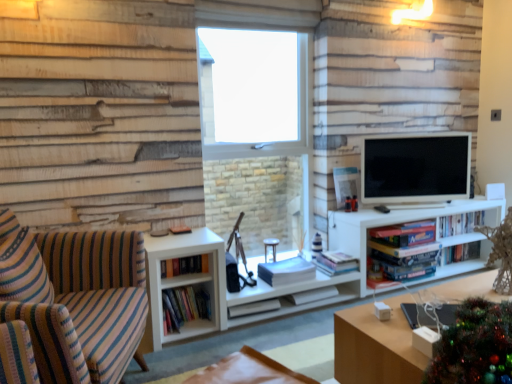
This screenshot has width=512, height=384. What are the coordinates of `wooden table at lower right` in the screenshot? It's located at (376, 346).

What are the coordinates of `hardcover books at center left, which is the 8th book in right-to-left order` in the screenshot? It's located at (184, 307).

In order to face striped fabric couch at left, should I rotate leftwards or rightwards?

You should rotate left by 27.601 degrees.

Locate an element on the screen. The width and height of the screenshot is (512, 384). white matte entertainment center at center is located at coordinates (352, 254).

How different are the orientations of hardcover books at center, placed as the 7th book when sorted from left to right, and white matte book at center, which is counted as the sixth book, starting from the right, in degrees?

1.54 degrees separate the facing orientations of hardcover books at center, placed as the 7th book when sorted from left to right, and white matte book at center, which is counted as the sixth book, starting from the right.

From the picture: How distant is hardcover books at center, placed as the 7th book when sorted from left to right, from white matte book at center, the 4th book viewed from the left?

A distance of 25.25 inches exists between hardcover books at center, placed as the 7th book when sorted from left to right, and white matte book at center, the 4th book viewed from the left.

Relative to white matte book at center, the 4th book viewed from the left, is hardcover books at center, which appears as the 3th book when viewed from the right, in front or behind?

In the image, hardcover books at center, which appears as the 3th book when viewed from the right, appears behind white matte book at center, the 4th book viewed from the left.

Considering the relative sizes of hardcover books at center, placed as the 7th book when sorted from left to right, and white matte book at center, which is counted as the sixth book, starting from the right, in the image provided, is hardcover books at center, placed as the 7th book when sorted from left to right, thinner than white matte book at center, which is counted as the sixth book, starting from the right,?

No, hardcover books at center, placed as the 7th book when sorted from left to right, is not thinner than white matte book at center, which is counted as the sixth book, starting from the right.

Would you consider white matte entertainment center at center to be distant from white matte book at center, the seventh book in the right-to-left sequence?

Actually, white matte entertainment center at center and white matte book at center, the seventh book in the right-to-left sequence, are a little close together.

Based on the photo, is white matte entertainment center at center surrounding white matte book at center, which is counted as the 3th book, starting from the left?

That's correct, white matte book at center, which is counted as the 3th book, starting from the left, is inside white matte entertainment center at center.

Which is nearer, (320, 304) or (256, 304)?

Point (320, 304) is positioned farther from the camera compared to point (256, 304).

Considering the sizes of objects white matte entertainment center at center and white matte book at center, the seventh book in the right-to-left sequence, in the image provided, who is smaller, white matte entertainment center at center or white matte book at center, the seventh book in the right-to-left sequence,?

white matte book at center, the seventh book in the right-to-left sequence.

Where is `entertainment center on the right side of white matte book at center, which is counted as the 3th book, starting from the left`? entertainment center on the right side of white matte book at center, which is counted as the 3th book, starting from the left is located at coordinates (352, 254).

From a real-world perspective, is white matte book at center, which is counted as the 3th book, starting from the left, over white matte entertainment center at center?

Actually, white matte book at center, which is counted as the 3th book, starting from the left, is physically below white matte entertainment center at center in the real world.

Between white matte book at center, which is counted as the 3th book, starting from the left, and white matte entertainment center at center, which one has smaller width?

Thinner between the two is white matte book at center, which is counted as the 3th book, starting from the left.

From the picture: In the image, is white matte book at center, which is counted as the 3th book, starting from the left, positioned in front of or behind white matte entertainment center at center?

Visually, white matte book at center, which is counted as the 3th book, starting from the left, is located behind white matte entertainment center at center.

Consider the image. How many degrees apart are the facing directions of hardcover book at center, which is the 5th book from right to left, and hardcover books at center left, the second book positioned from the left?

There is a 0.000756-degree angle between the facing directions of hardcover book at center, which is the 5th book from right to left, and hardcover books at center left, the second book positioned from the left.

From the image's perspective, which book is the 1st one below the hardcover books at center left, which is the 8th book in right-to-left order? Please provide its 2D coordinates.

[(313, 295)]

From a real-world perspective, is hardcover book at center, which is the 5th book from right to left, positioned over hardcover books at center left, which is the 8th book in right-to-left order, based on gravity?

No, from a real-world perspective, hardcover book at center, which is the 5th book from right to left, is not above hardcover books at center left, which is the 8th book in right-to-left order.

From a real-world perspective, is striped fabric couch at left above or below white matte entertainment center at center?

striped fabric couch at left is situated higher than white matte entertainment center at center in the real world.

Are striped fabric couch at left and white matte entertainment center at center far apart?

Actually, striped fabric couch at left and white matte entertainment center at center are a little close together.

Does striped fabric couch at left have a greater height compared to white matte entertainment center at center?

Correct, striped fabric couch at left is much taller as white matte entertainment center at center.

Locate an element on the screen. The image size is (512, 384). studio couch that is below the white matte entertainment center at center (from the image's perspective) is located at coordinates (75, 299).

Is white matte book at center, the seventh book in the right-to-left sequence, spatially inside matte black tv at right, or outside of it?

white matte book at center, the seventh book in the right-to-left sequence, lies outside matte black tv at right.

Is white matte book at center, which is counted as the 3th book, starting from the left, in front of or behind matte black tv at right in the image?

white matte book at center, which is counted as the 3th book, starting from the left, is in front of matte black tv at right.

Measure the distance from white matte book at center, the seventh book in the right-to-left sequence, to matte black tv at right.

The distance of white matte book at center, the seventh book in the right-to-left sequence, from matte black tv at right is 1.27 meters.

Is point (236, 310) positioned after point (447, 180)?

No.

From their relative heights in the image, would you say white matte entertainment center at center is taller or shorter than matte black tv at right?

Clearly, white matte entertainment center at center is taller compared to matte black tv at right.

Can you see white matte entertainment center at center touching matte black tv at right?

No, white matte entertainment center at center is not in contact with matte black tv at right.

How far apart are white matte entertainment center at center and matte black tv at right?

white matte entertainment center at center is 13.54 inches away from matte black tv at right.

Find the location of a particular element. television located above the white matte entertainment center at center (from the image's perspective) is located at coordinates (416, 168).

Where is `book that is the 3rd one when counting leftward from the hardcover books at center, placed as the 7th book when sorted from left to right`? This screenshot has height=384, width=512. book that is the 3rd one when counting leftward from the hardcover books at center, placed as the 7th book when sorted from left to right is located at coordinates (286, 271).

Locate an element on the screen. Image resolution: width=512 pixels, height=384 pixels. entertainment center in front of the white matte book at center, which is counted as the 3th book, starting from the left is located at coordinates (352, 254).

Estimate the real-world distances between objects in this image. Which object is further from white matte entertainment center at center, hardcover books at center, which appears as the 1th book when viewed from the left, or hardcover books at center left, which is the 8th book in right-to-left order?

The object further to white matte entertainment center at center is hardcover books at center, which appears as the 1th book when viewed from the left.

Which object lies further to the anchor point white matte book at center, the seventh book in the right-to-left sequence, hardcover books at center, the fourth book positioned from the right, or wooden table at lower right?

wooden table at lower right lies further to white matte book at center, the seventh book in the right-to-left sequence, than the other object.

Considering their positions, is hardcover books at right, marked as the second book in a right-to-left arrangement, positioned further to hardcover books at center, placed as the 7th book when sorted from left to right, than hardcover book at center, the fifth book when ordered from left to right?

The object further to hardcover books at center, placed as the 7th book when sorted from left to right, is hardcover book at center, the fifth book when ordered from left to right.

Considering their positions, is white matte book at center, which is counted as the sixth book, starting from the right, positioned closer to wooden table at lower right than hardcover books at center left, the second book positioned from the left?

white matte book at center, which is counted as the sixth book, starting from the right, is positioned closer to the anchor wooden table at lower right.

Based on their spatial positions, is hardcover books at center, the sixth book in the left-to-right sequence, or hardcover book at right, which is counted as the 9th book, starting from the left, closer to hardcover book at center, the fifth book when ordered from left to right?

Based on the image, hardcover books at center, the sixth book in the left-to-right sequence, appears to be nearer to hardcover book at center, the fifth book when ordered from left to right.

Considering their positions, is hardcover books at center, the fourth book positioned from the right, positioned further to white matte entertainment center at center than white matte book at center, the 4th book viewed from the left?

white matte book at center, the 4th book viewed from the left.

From the picture: Estimate the real-world distances between objects in this image. Which object is closer to white matte entertainment center at center, hardcover book at center, the fifth book when ordered from left to right, or white matte book at center, the 4th book viewed from the left?

white matte book at center, the 4th book viewed from the left, is closer to white matte entertainment center at center.

Based on their spatial positions, is hardcover books at center left, which is the 8th book in right-to-left order, or hardcover books at center, which appears as the ninth book when viewed from the right, closer to matte black tv at right?

hardcover books at center, which appears as the ninth book when viewed from the right.

Where is `television situated between hardcover books at center, which appears as the 3th book when viewed from the right, and hardcover books at right, marked as the second book in a right-to-left arrangement, from left to right`? television situated between hardcover books at center, which appears as the 3th book when viewed from the right, and hardcover books at right, marked as the second book in a right-to-left arrangement, from left to right is located at coordinates (416, 168).

The height and width of the screenshot is (384, 512). Find the location of `television between striped fabric couch at left and hardcover book at right, which is counted as the 9th book, starting from the left`. television between striped fabric couch at left and hardcover book at right, which is counted as the 9th book, starting from the left is located at coordinates (416, 168).

The image size is (512, 384). I want to click on entertainment center between wooden table at lower right and hardcover books at center, the fourth book positioned from the right, in the front-back direction, so click(x=352, y=254).

Locate an element on the screen. The height and width of the screenshot is (384, 512). television between white matte book at center, the 4th book viewed from the left, and hardcover book at right, the 1th book from the right, in the horizontal direction is located at coordinates (416, 168).